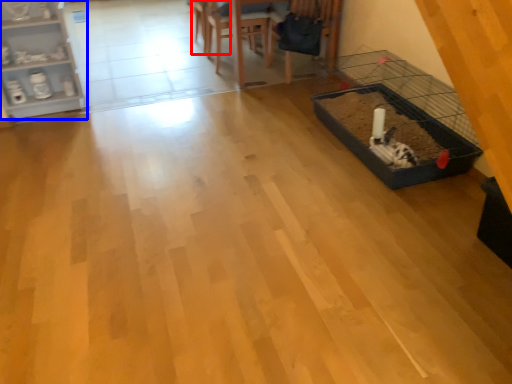
Question: Which point is further to the camera, armchair (highlighted by a red box) or shelf (highlighted by a blue box)?

Choices:
 (A) armchair
 (B) shelf

Answer: (A)